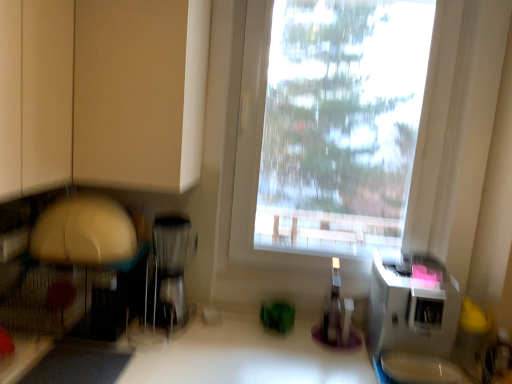
Question: Should I look upward or downward to see transparent plastic window at center?

Choices:
 (A) up
 (B) down

Answer: (A)

Question: Is white plastic microwave at right, which ranks as the first appliance in right-to-left order, smaller than satin silver coffee maker at center, the first appliance when ordered from left to right?

Choices:
 (A) no
 (B) yes

Answer: (A)

Question: From the image's perspective, is white plastic microwave at right, arranged as the second appliance when viewed from the left, above satin silver coffee maker at center, the first appliance when ordered from left to right?

Choices:
 (A) no
 (B) yes

Answer: (A)

Question: Considering the relative positions of white plastic microwave at right, arranged as the second appliance when viewed from the left, and satin silver coffee maker at center, marked as the second appliance in a right-to-left arrangement, in the image provided, is white plastic microwave at right, arranged as the second appliance when viewed from the left, to the left of satin silver coffee maker at center, marked as the second appliance in a right-to-left arrangement, from the viewer's perspective?

Choices:
 (A) yes
 (B) no

Answer: (B)

Question: Can satin silver coffee maker at center, marked as the second appliance in a right-to-left arrangement, be found inside white plastic microwave at right, which ranks as the first appliance in right-to-left order?

Choices:
 (A) yes
 (B) no

Answer: (B)

Question: From a real-world perspective, is white plastic microwave at right, which ranks as the first appliance in right-to-left order, located higher than satin silver coffee maker at center, the first appliance when ordered from left to right?

Choices:
 (A) yes
 (B) no

Answer: (B)

Question: Is white plastic microwave at right, arranged as the second appliance when viewed from the left, not inside satin silver coffee maker at center, the first appliance when ordered from left to right?

Choices:
 (A) no
 (B) yes

Answer: (B)

Question: Considering the relative sizes of satin silver coffee maker at center, the first appliance when ordered from left to right, and white plastic microwave at right, arranged as the second appliance when viewed from the left, in the image provided, is satin silver coffee maker at center, the first appliance when ordered from left to right, thinner than white plastic microwave at right, arranged as the second appliance when viewed from the left,?

Choices:
 (A) no
 (B) yes

Answer: (B)

Question: Is satin silver coffee maker at center, the first appliance when ordered from left to right, surrounding white plastic microwave at right, arranged as the second appliance when viewed from the left?

Choices:
 (A) no
 (B) yes

Answer: (A)

Question: Is satin silver coffee maker at center, marked as the second appliance in a right-to-left arrangement, further to camera compared to white plastic microwave at right, arranged as the second appliance when viewed from the left?

Choices:
 (A) yes
 (B) no

Answer: (A)

Question: From the image's perspective, would you say satin silver coffee maker at center, marked as the second appliance in a right-to-left arrangement, is positioned over white plastic microwave at right, arranged as the second appliance when viewed from the left?

Choices:
 (A) yes
 (B) no

Answer: (A)

Question: From a real-world perspective, is satin silver coffee maker at center, marked as the second appliance in a right-to-left arrangement, positioned under white plastic microwave at right, arranged as the second appliance when viewed from the left, based on gravity?

Choices:
 (A) yes
 (B) no

Answer: (B)

Question: Are satin silver coffee maker at center, the first appliance when ordered from left to right, and white plastic microwave at right, which ranks as the first appliance in right-to-left order, beside each other?

Choices:
 (A) no
 (B) yes

Answer: (A)

Question: Considering the relative sizes of transparent plastic bottle at center and satin silver coffee maker at center, marked as the second appliance in a right-to-left arrangement, in the image provided, is transparent plastic bottle at center wider than satin silver coffee maker at center, marked as the second appliance in a right-to-left arrangement,?

Choices:
 (A) no
 (B) yes

Answer: (A)